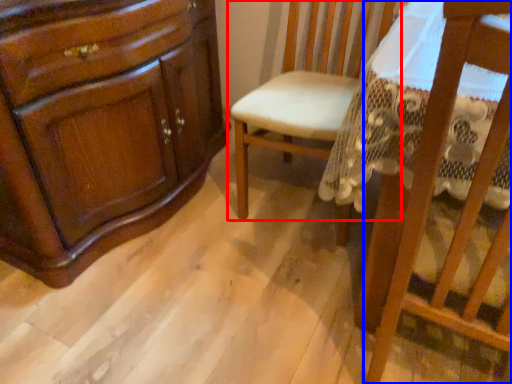
Question: Which of the following is the closest to the observer, chair (highlighted by a red box) or chair (highlighted by a blue box)?

Choices:
 (A) chair
 (B) chair

Answer: (B)